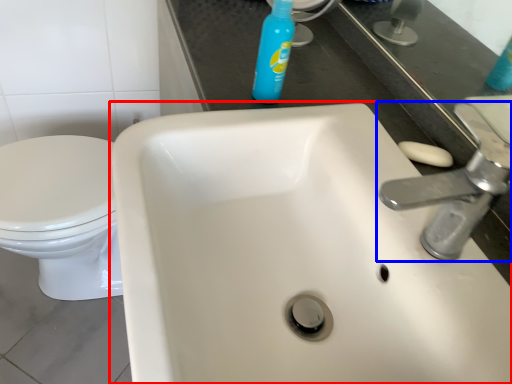
Question: Which of the following is the farthest to the observer, sink (highlighted by a red box) or tap (highlighted by a blue box)?

Choices:
 (A) sink
 (B) tap

Answer: (B)